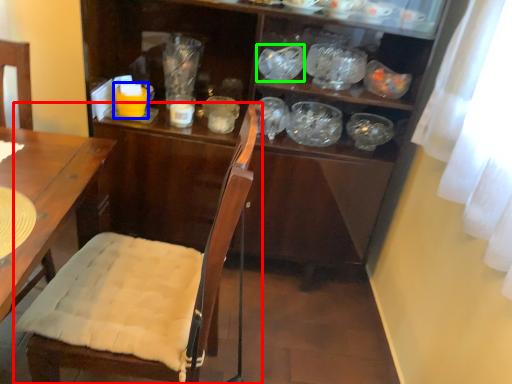
Question: Which object is positioned farthest from chair (highlighted by a red box)? Select from tableware (highlighted by a blue box) and tableware (highlighted by a green box).

Choices:
 (A) tableware
 (B) tableware

Answer: (B)